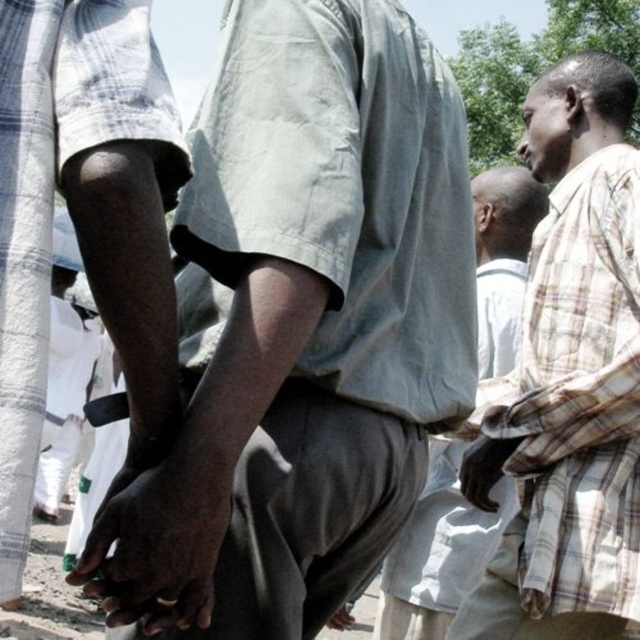
Between plaid fabric shirt at right and dark skin hand at center, which one appears on the left side from the viewer's perspective?

Positioned to the left is dark skin hand at center.

Is plaid fabric shirt at right below dark skin hand at center?

Yes, plaid fabric shirt at right is below dark skin hand at center.

You are a GUI agent. You are given a task and a screenshot of the screen. Output one action in this format:
    pyautogui.click(x=<x>, y=<y>)
    Task: Click on the plaid fabric shirt at right
    
    Given the screenshot: What is the action you would take?
    pyautogui.click(x=568, y=380)

Which is in front, point (404, 76) or point (477, 250)?

Point (404, 76)

Find the location of a particular element. This screenshot has height=640, width=640. light gray cotton shirt at center is located at coordinates (301, 326).

Locate an element on the screen. light gray cotton shirt at center is located at coordinates (301, 326).

Who is more distant from viewer, (556, 106) or (436, 497)?

A: The point (436, 497) is more distant.

Between point (500, 637) and point (422, 531), which one is positioned behind?

The point (422, 531) is behind.

At what (x,y) coordinates should I click in order to perform the action: click on plaid fabric shirt at right. Please return your answer as a coordinate pair (x, y). This screenshot has width=640, height=640. Looking at the image, I should click on (568, 380).